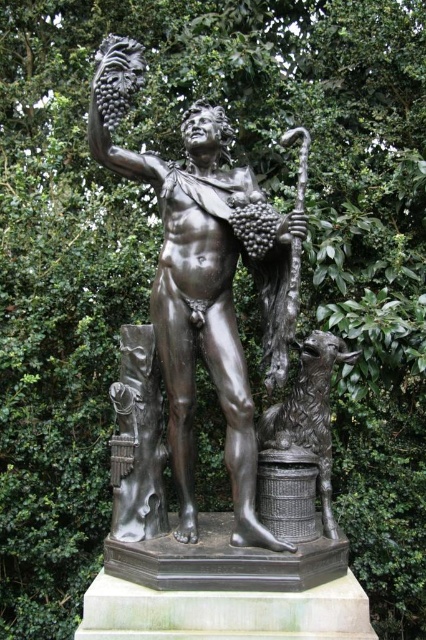
Question: Is bronze statue at center in front of shiny bronze basket at lower center?

Choices:
 (A) no
 (B) yes

Answer: (B)

Question: Is bronze statue at center to the right of shiny bronze basket at lower center from the viewer's perspective?

Choices:
 (A) yes
 (B) no

Answer: (B)

Question: Which of the following is the farthest from the observer?

Choices:
 (A) (298, 490)
 (B) (241, 397)

Answer: (A)

Question: Which point is closer to the camera taking this photo?

Choices:
 (A) (316, 429)
 (B) (239, 170)

Answer: (A)

Question: Is bronze statue at center thinner than shiny bronze basket at lower center?

Choices:
 (A) yes
 (B) no

Answer: (B)